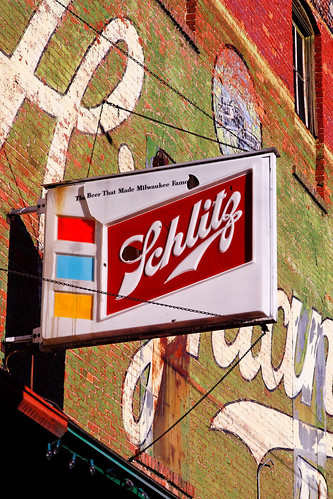
Locate an element on the screen. This screenshot has height=499, width=333. dark window pane is located at coordinates click(x=301, y=64), click(x=301, y=103), click(x=293, y=41), click(x=295, y=94).